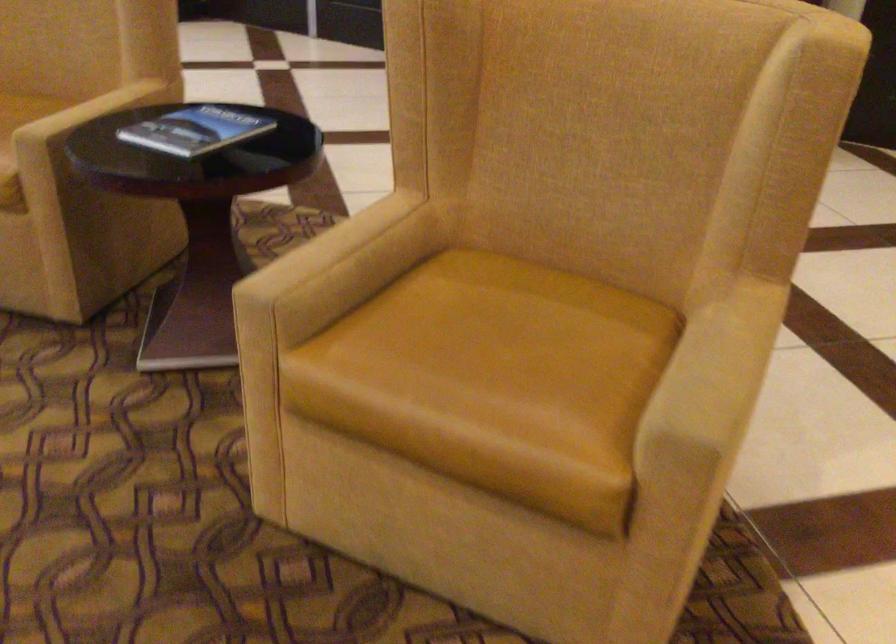
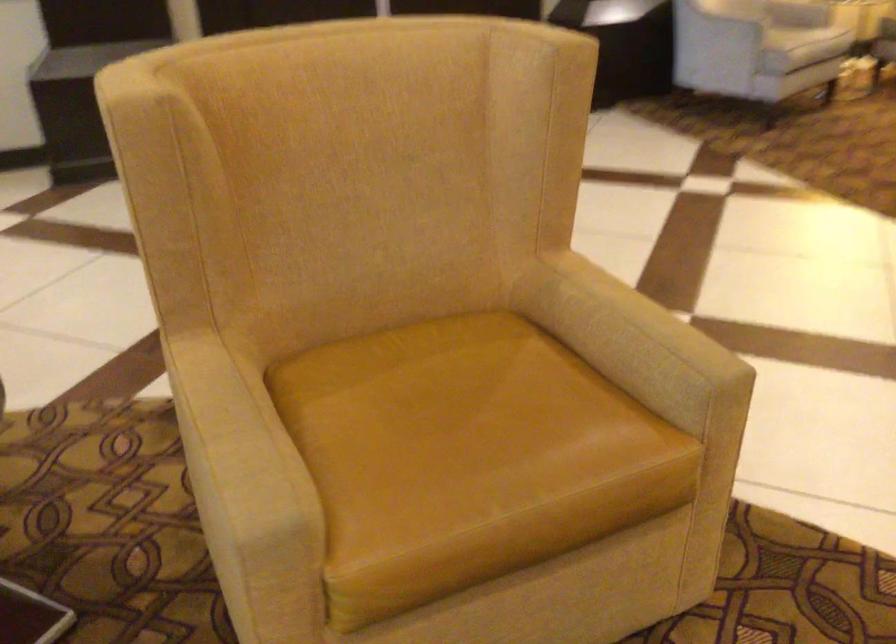
Find the pixel in the second image that matches pixel 332 247 in the first image.

(235, 435)